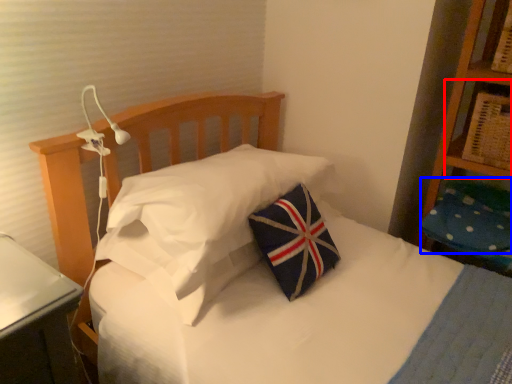
Question: Which object appears closest to the camera in this image, shelf (highlighted by a red box) or pillow (highlighted by a blue box)?

Choices:
 (A) shelf
 (B) pillow

Answer: (A)